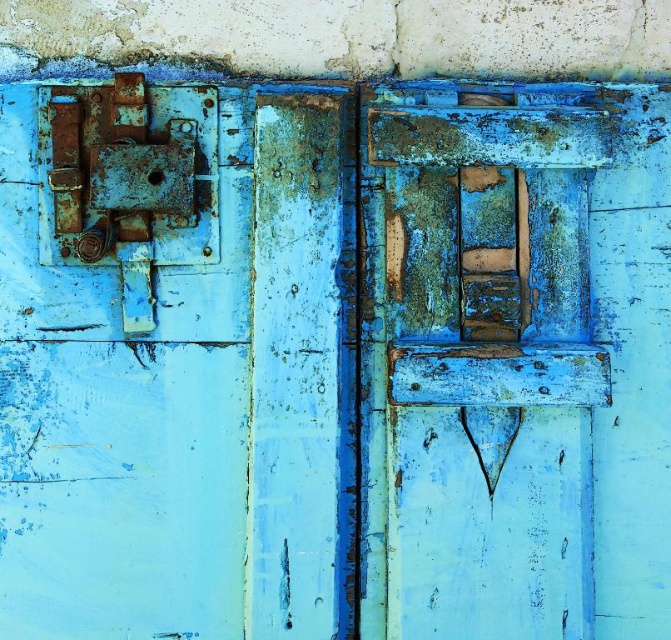
You are a maintenance worker needing to replace the rusty metal lock at left on the rusty wood door at center. The manufacturer specifies that the new lock must be installed at least 8 inches away from the edge of the door. Based on the image, can you safely install the new lock without violating this requirement?

The distance between the rusty metal lock at left and the rusty wood door at center is 7.38 inches, which is less than the required 8 inches. Therefore, you cannot safely install the new lock without violating the manufacturer requirement.

You are standing in front of the weathered wooden door. You need to locate the rusty metal lock at left. Can you tell me the coordinates of its position?

The rusty metal lock at left is located at coordinates point (123,358).